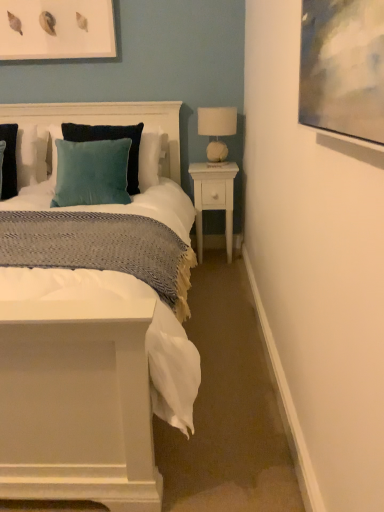
What do you see at coordinates (107, 120) in the screenshot? The image size is (384, 512). I see `velvet cushion at upper left` at bounding box center [107, 120].

This screenshot has width=384, height=512. Identify the location of white wood nightstand at right. (214, 198).

Measure the distance between velvet teal pillow at center and camera.

velvet teal pillow at center is 7.43 feet from camera.

Describe the element at coordinates (217, 129) in the screenshot. I see `white textured lampshade at right` at that location.

The width and height of the screenshot is (384, 512). I want to click on velvet cushion at upper left, so click(107, 120).

Is matte white picture frame at upper left looking in the opposite direction of white textured lampshade at right?

No.

Between matte white picture frame at upper left and white textured lampshade at right, which one is positioned behind?

white textured lampshade at right.

Can you confirm if matte white picture frame at upper left is wider than white textured lampshade at right?

No, matte white picture frame at upper left is not wider than white textured lampshade at right.

Does point (58, 16) appear closer or farther from the camera than point (209, 125)?

Point (58, 16) is farther from the camera than point (209, 125).

Is velvet cushion at upper left directly adjacent to white textured lampshade at right?

No, velvet cushion at upper left is not making contact with white textured lampshade at right.

Is velvet cushion at upper left facing away from white textured lampshade at right?

That's not correct — velvet cushion at upper left is not looking away from white textured lampshade at right.

From the image's perspective, is velvet cushion at upper left below white textured lampshade at right?

Yes.

From a real-world perspective, is velvet cushion at upper left positioned under white textured lampshade at right based on gravity?

Indeed, from a real-world perspective, velvet cushion at upper left is positioned beneath white textured lampshade at right.

From the image's perspective, is white textured lampshade at right located beneath velvet teal pillow at center?

No.

Which is closer to the camera, (212, 110) or (157, 132)?

Point (212, 110) is closer to the camera than point (157, 132).

Identify the location of pillow lying in front of the white textured lampshade at right. This screenshot has width=384, height=512. (129, 151).

Are white textured lampshade at right and velvet teal pillow at center located far from each other?

No, there isn't a large distance between white textured lampshade at right and velvet teal pillow at center.

How distant is white textured lampshade at right from matte white picture frame at upper left?

The distance of white textured lampshade at right from matte white picture frame at upper left is 38.94 inches.

Based on the photo, is matte white picture frame at upper left a part of white textured lampshade at right?

No, matte white picture frame at upper left is not inside white textured lampshade at right.

Does white textured lampshade at right have a smaller size compared to matte white picture frame at upper left?

Yes, white textured lampshade at right is smaller than matte white picture frame at upper left.

From the image's perspective, is white textured lampshade at right above or below matte white picture frame at upper left?

white textured lampshade at right is situated lower than matte white picture frame at upper left in the image.

How far apart are white textured lampshade at right and white wood nightstand at right?

white textured lampshade at right is 28.63 centimeters away from white wood nightstand at right.

In terms of size, does white textured lampshade at right appear bigger or smaller than white wood nightstand at right?

white textured lampshade at right is smaller than white wood nightstand at right.

Considering the relative sizes of white textured lampshade at right and white wood nightstand at right in the image provided, is white textured lampshade at right shorter than white wood nightstand at right?

Yes.

Would you say white textured lampshade at right is to the left or to the right of white wood nightstand at right in the picture?

white textured lampshade at right is to the right of white wood nightstand at right.

From the image's perspective, between white wood nightstand at right and velvet cushion at upper left, which one is located above?

velvet cushion at upper left, from the image's perspective.

Which of these two, white wood nightstand at right or velvet cushion at upper left, is thinner?

white wood nightstand at right.

In terms of height, does white wood nightstand at right look taller or shorter compared to velvet cushion at upper left?

In the image, white wood nightstand at right appears to be taller than velvet cushion at upper left.

Considering the positions of objects white wood nightstand at right and matte white picture frame at upper left in the image provided, who is more to the right, white wood nightstand at right or matte white picture frame at upper left?

Positioned to the right is white wood nightstand at right.

Considering the sizes of white wood nightstand at right and matte white picture frame at upper left in the image, is white wood nightstand at right wider or thinner than matte white picture frame at upper left?

In the image, white wood nightstand at right appears to be wider than matte white picture frame at upper left.

Is white wood nightstand at right positioned far away from matte white picture frame at upper left?

Yes, white wood nightstand at right is far from matte white picture frame at upper left.

Could matte white picture frame at upper left be considered to be inside white wood nightstand at right?

No, white wood nightstand at right does not contain matte white picture frame at upper left.

The image size is (384, 512). I want to click on table lamp that is on the right side of matte white picture frame at upper left, so click(x=217, y=129).

You are a GUI agent. You are given a task and a screenshot of the screen. Output one action in this format:
    pyautogui.click(x=<x>, y=<y>)
    Task: Click on the table lamp located above the velvet cushion at upper left (from the image's perspective)
    Image resolution: width=384 pixels, height=512 pixels.
    Given the screenshot: What is the action you would take?
    pyautogui.click(x=217, y=129)

Looking at the image, which one is located further to velvet teal pillow at center, white wood nightstand at right or white textured lampshade at right?

white textured lampshade at right is positioned further to the anchor velvet teal pillow at center.

When comparing their distances from white textured lampshade at right, does velvet cushion at upper left or velvet teal pillow at center seem further?

velvet teal pillow at center.

Based on their spatial positions, is white wood nightstand at right or velvet teal pillow at center closer to white textured lampshade at right?

white wood nightstand at right lies closer to white textured lampshade at right than the other object.

Estimate the real-world distances between objects in this image. Which object is closer to matte white picture frame at upper left, white wood nightstand at right or white textured lampshade at right?

The object closer to matte white picture frame at upper left is white textured lampshade at right.

Looking at this image, when comparing their distances from velvet teal pillow at center, does velvet cushion at upper left or matte white picture frame at upper left seem further?

Among the two, matte white picture frame at upper left is located further to velvet teal pillow at center.

Which object lies further to the anchor point white textured lampshade at right, velvet teal pillow at center or white wood nightstand at right?

velvet teal pillow at center is positioned further to the anchor white textured lampshade at right.

Based on their spatial positions, is velvet teal pillow at center or white wood nightstand at right closer to matte white picture frame at upper left?

velvet teal pillow at center.

From the picture: Looking at the image, which one is located further to velvet teal pillow at center, velvet cushion at upper left or white wood nightstand at right?

The object further to velvet teal pillow at center is white wood nightstand at right.

This screenshot has height=512, width=384. Identify the location of nightstand situated between velvet teal pillow at center and white textured lampshade at right from left to right. 214,198.

What are the coordinates of `nightstand between matte white picture frame at upper left and white textured lampshade at right` in the screenshot? It's located at (214, 198).

Identify the location of headboard between matte white picture frame at upper left and white textured lampshade at right from left to right. (107, 120).

Find the location of a particular element. The width and height of the screenshot is (384, 512). headboard between velvet teal pillow at center and white textured lampshade at right is located at coordinates (107, 120).